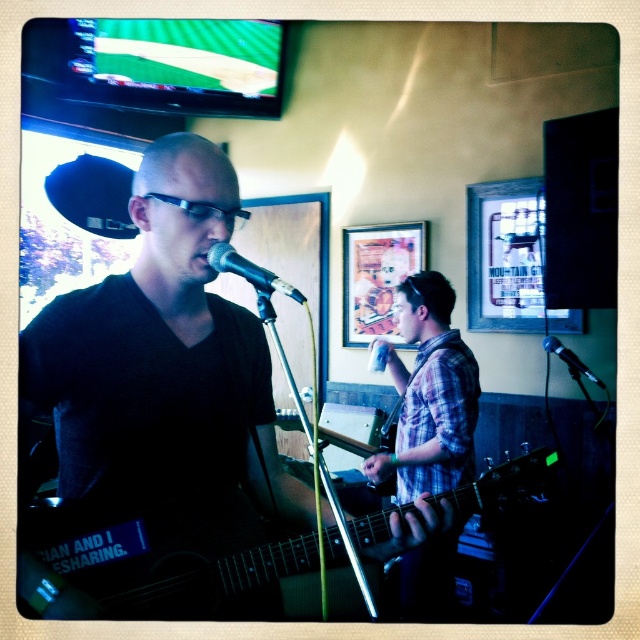
You are a photographer at the live music event. You want to capture a photo that includes both the black matte guitar at center and the plaid fabric shirt at center. Based on their positions, which object should be on the left side of the photo?

The black matte guitar at center is positioned on the left side of the plaid fabric shirt at center, so in the photo, the black matte guitar at center should be on the left side.

You are a sound technician in the audience of this live music performance. You need to adjust the microphone stand so that the metallic silver microphone at center is positioned exactly at point 0.5, 0.5 on the 2D grid. Is the microphone currently positioned correctly?

The metallic silver microphone at center is currently located at point (250, 273), which is not exactly at (320, 320). Therefore, the microphone is not positioned correctly and needs adjustment.

Consider the image. You are standing at the point marked by the coordinates point (260, 289) in the image. You want to move to the stage entrance located 3 meters directly behind you. Can you walk straight back without moving sideways?

The distance between you and the point marked by the coordinates point (260, 289) is 1.02 meters. Since the stage entrance is 3 meters behind you, you have enough space to walk straight back without needing to move sideways.